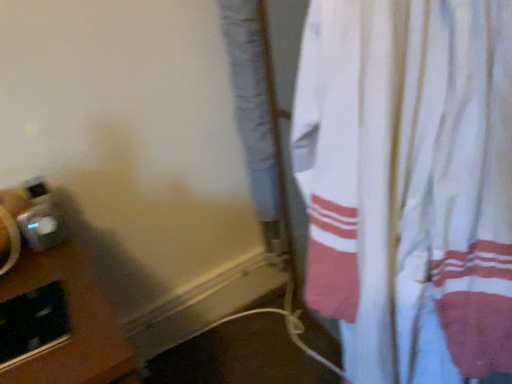
Question: Is brown wooden table at lower left wider than white cotton curtain at right?

Choices:
 (A) no
 (B) yes

Answer: (B)

Question: Is brown wooden table at lower left further to the viewer compared to white cotton curtain at right?

Choices:
 (A) yes
 (B) no

Answer: (A)

Question: Is brown wooden table at lower left not close to white cotton curtain at right?

Choices:
 (A) yes
 (B) no

Answer: (B)

Question: Considering the relative sizes of brown wooden table at lower left and white cotton curtain at right in the image provided, is brown wooden table at lower left thinner than white cotton curtain at right?

Choices:
 (A) no
 (B) yes

Answer: (A)

Question: Does brown wooden table at lower left have a greater height compared to white cotton curtain at right?

Choices:
 (A) no
 (B) yes

Answer: (A)

Question: Is white cotton curtain at right at the back of brown wooden table at lower left?

Choices:
 (A) yes
 (B) no

Answer: (B)

Question: Does white cotton curtain at right lie behind brown wooden table at lower left?

Choices:
 (A) yes
 (B) no

Answer: (B)

Question: From a real-world perspective, does white cotton curtain at right stand above brown wooden table at lower left?

Choices:
 (A) no
 (B) yes

Answer: (B)

Question: Could you tell me if white cotton curtain at right is facing brown wooden table at lower left?

Choices:
 (A) no
 (B) yes

Answer: (A)

Question: Is white cotton curtain at right turned away from brown wooden table at lower left?

Choices:
 (A) yes
 (B) no

Answer: (B)

Question: Is white cotton curtain at right taller than brown wooden table at lower left?

Choices:
 (A) yes
 (B) no

Answer: (A)

Question: Can you confirm if white cotton curtain at right is shorter than brown wooden table at lower left?

Choices:
 (A) yes
 (B) no

Answer: (B)

Question: Do you think white cotton curtain at right is within brown wooden table at lower left, or outside of it?

Choices:
 (A) outside
 (B) inside

Answer: (A)